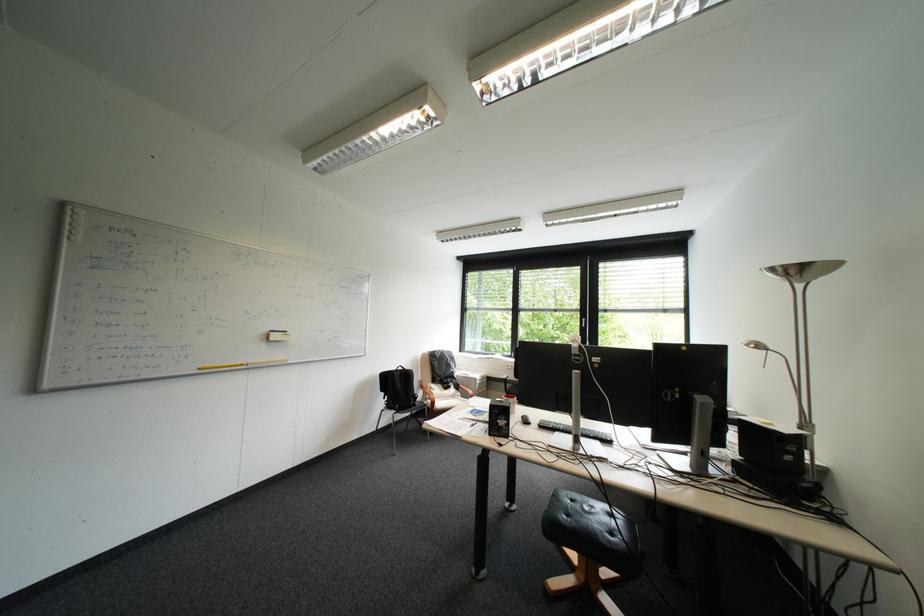
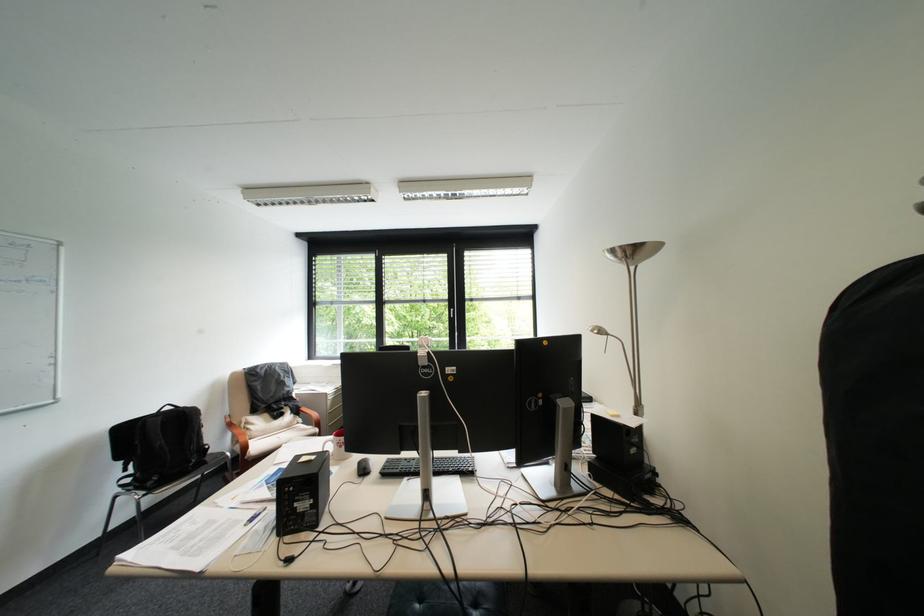
Question: The first image is from the beginning of the video and the second image is from the end. How did the camera likely rotate when shooting the video?

Choices:
 (A) Left
 (B) Right
 (C) Up
 (D) Down

Answer: (B)